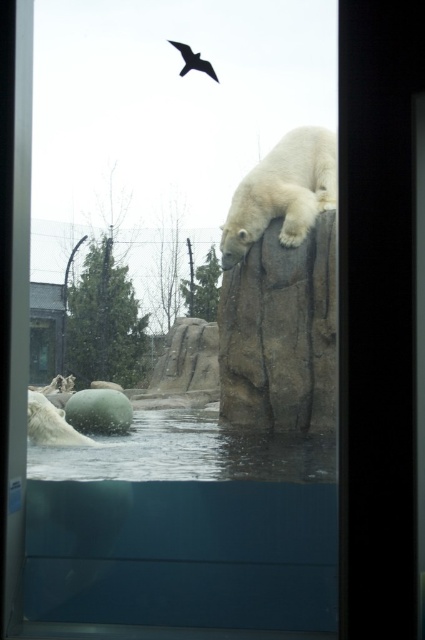
Question: Is smooth gray rock at center behind clear water at lower center?

Choices:
 (A) yes
 (B) no

Answer: (A)

Question: Is clear water at lower center closer to camera compared to white fur bear at upper center?

Choices:
 (A) yes
 (B) no

Answer: (A)

Question: Which of the following is the closest to the observer?

Choices:
 (A) (210, 76)
 (B) (246, 432)
 (C) (336, 200)
 (D) (62, 588)

Answer: (D)

Question: Which point is closer to the camera taking this photo?

Choices:
 (A) (308, 502)
 (B) (189, 56)
 (C) (308, 300)
 (D) (333, 204)

Answer: (A)

Question: Can you confirm if smooth gray rock at center is positioned to the right of white fur bear at upper center?

Choices:
 (A) yes
 (B) no

Answer: (B)

Question: Based on their relative distances, which object is farther from the white fur bear at upper center?

Choices:
 (A) smooth gray rock at center
 (B) transparent glass pool at lower center
 (C) clear water at lower center
 (D) black feathered bird at upper center

Answer: (D)